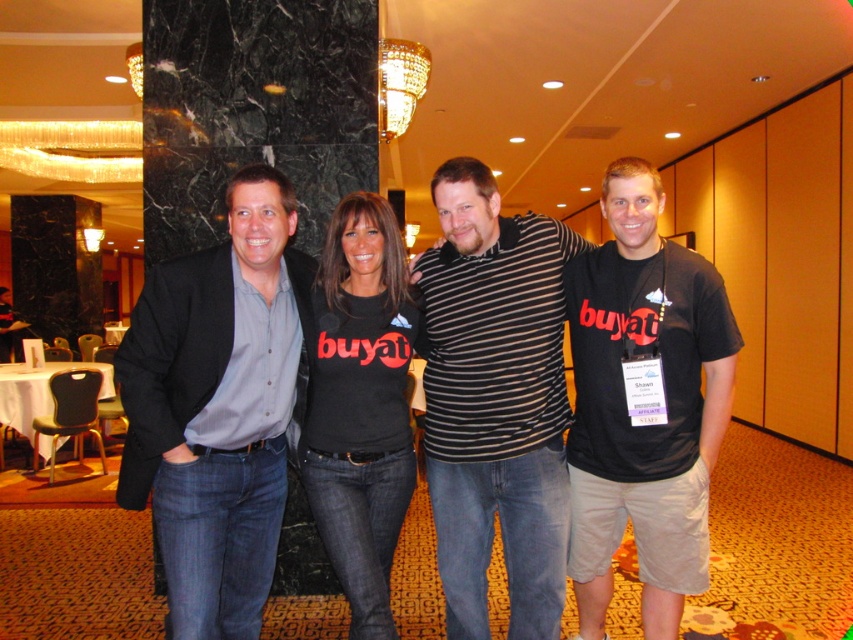
Question: Can you confirm if matte gray blazer at center is wider than black cotton t-shirt at right?

Choices:
 (A) no
 (B) yes

Answer: (B)

Question: Which object is the farthest from the striped cotton shirt at center?

Choices:
 (A) black cotton t-shirt at center
 (B) matte gray blazer at center
 (C) black cotton t-shirt at right

Answer: (B)

Question: Where is striped cotton shirt at center located in relation to black cotton t-shirt at right in the image?

Choices:
 (A) left
 (B) right

Answer: (A)

Question: Which of the following is the closest to the observer?

Choices:
 (A) (515, 244)
 (B) (610, 561)
 (C) (247, 442)
 (D) (384, 582)

Answer: (C)

Question: Is matte gray blazer at center bigger than black cotton t-shirt at center?

Choices:
 (A) no
 (B) yes

Answer: (B)

Question: Estimate the real-world distances between objects in this image. Which object is farther from the striped cotton shirt at center?

Choices:
 (A) black cotton t-shirt at center
 (B) black cotton t-shirt at right
 (C) matte gray blazer at center

Answer: (C)